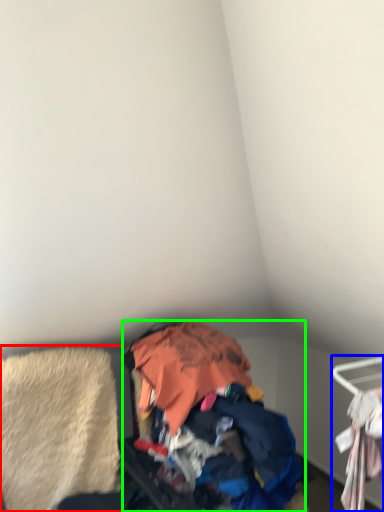
Question: Which is nearer to the clothing (highlighted by a red box)? furniture (highlighted by a blue box) or garbage (highlighted by a green box).

Choices:
 (A) furniture
 (B) garbage

Answer: (B)